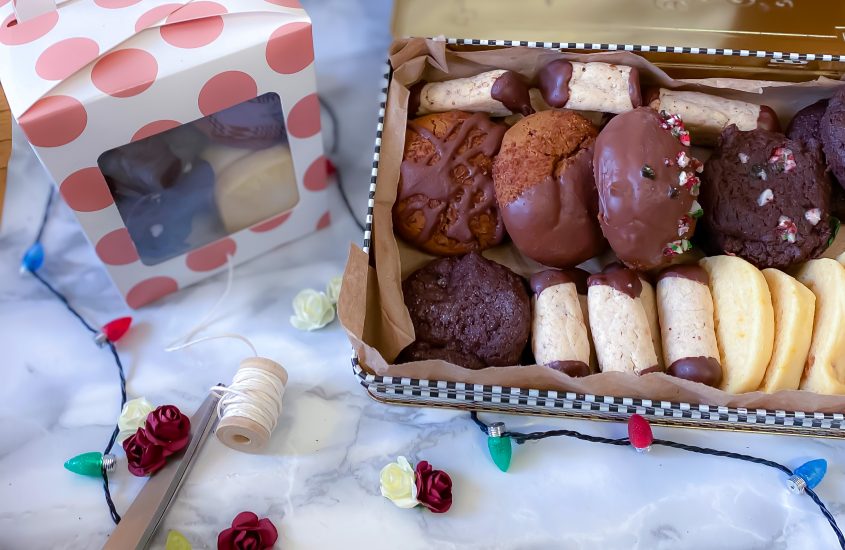
What are the coordinates of `green light` in the screenshot? It's located at (90, 466).